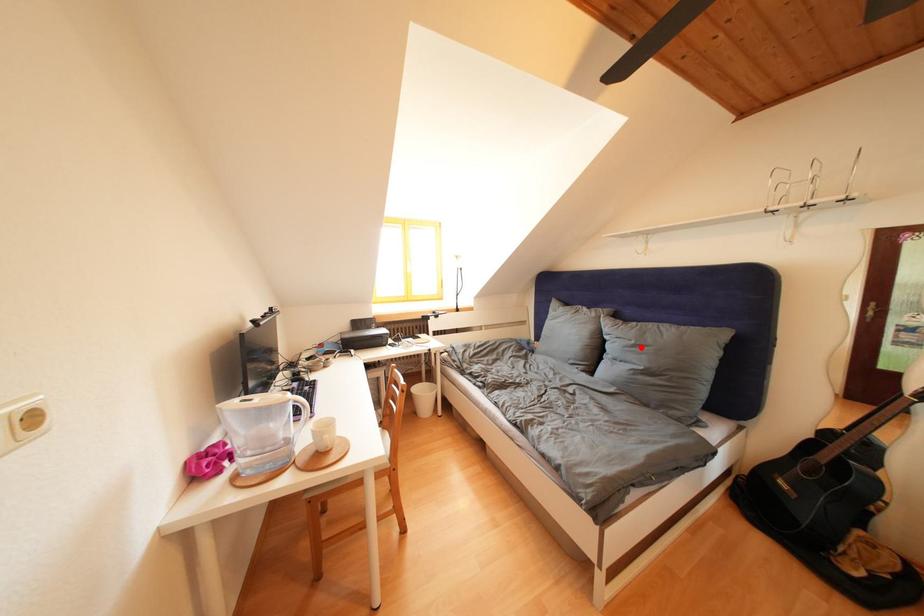
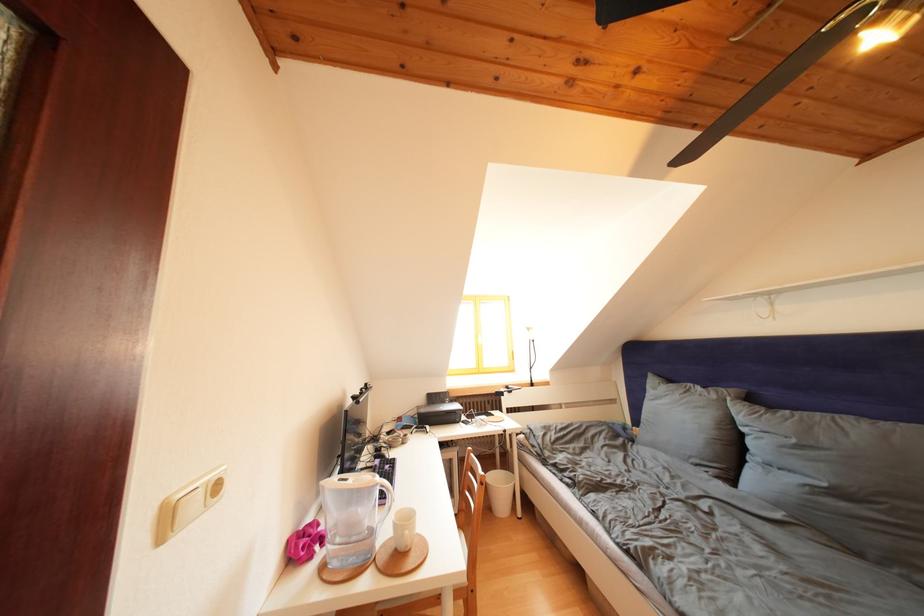
The point at the highlighted location is marked in the first image. Where is the corresponding point in the second image?

(801, 446)